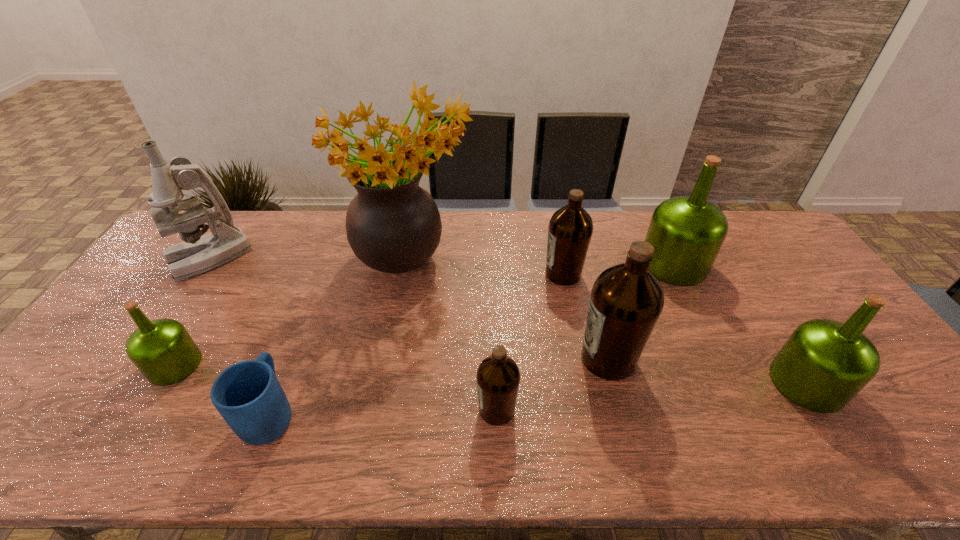
You are a GUI agent. You are given a task and a screenshot of the screen. Output one action in this format:
    pyautogui.click(x=<x>, y=<y>)
    Task: Click on the fifth object from left to right
    Image resolution: width=960 pixels, height=540 pixels.
    Given the screenshot: What is the action you would take?
    pyautogui.click(x=498, y=377)

Image resolution: width=960 pixels, height=540 pixels. Find the location of `the seventh object from right to left`. the seventh object from right to left is located at coordinates (248, 395).

Locate an element on the screen. the shortest object is located at coordinates (248, 395).

You are a GUI agent. You are given a task and a screenshot of the screen. Output one action in this format:
    pyautogui.click(x=<x>, y=<y>)
    Task: Click on the free space located on the right of the flower arrangement
    The image size is (960, 540).
    Given the screenshot: What is the action you would take?
    pyautogui.click(x=563, y=260)

At what (x,y) coordinates should I click in order to perform the action: click on free space located on the front of the gray microscope. Please return your answer as a coordinate pair (x, y). Looking at the image, I should click on (x=140, y=359).

Identify the location of free spot located on the right of the biggest green olive oil. click(765, 264).

Locate an element on the screen. blank space located 0.350m on the label of the second nearest brown olive oil is located at coordinates (444, 359).

Where is `vacant space situated 0.370m on the label of the second nearest brown olive oil`? The image size is (960, 540). vacant space situated 0.370m on the label of the second nearest brown olive oil is located at coordinates (436, 359).

At what (x,y) coordinates should I click in order to perform the action: click on free space located 0.400m on the label of the second nearest brown olive oil. Please return your answer as a coordinate pair (x, y). The image size is (960, 540). Looking at the image, I should click on (424, 359).

Where is `vacant area located on the back of the second biggest green olive oil`? The image size is (960, 540). vacant area located on the back of the second biggest green olive oil is located at coordinates (740, 278).